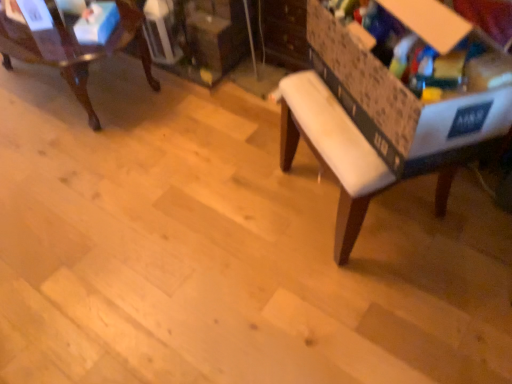
Locate an element on the screen. The width and height of the screenshot is (512, 384). vacant region to the left of blue cardboard box at upper left, which is the 2th storage box in front-to-back order is located at coordinates (54, 38).